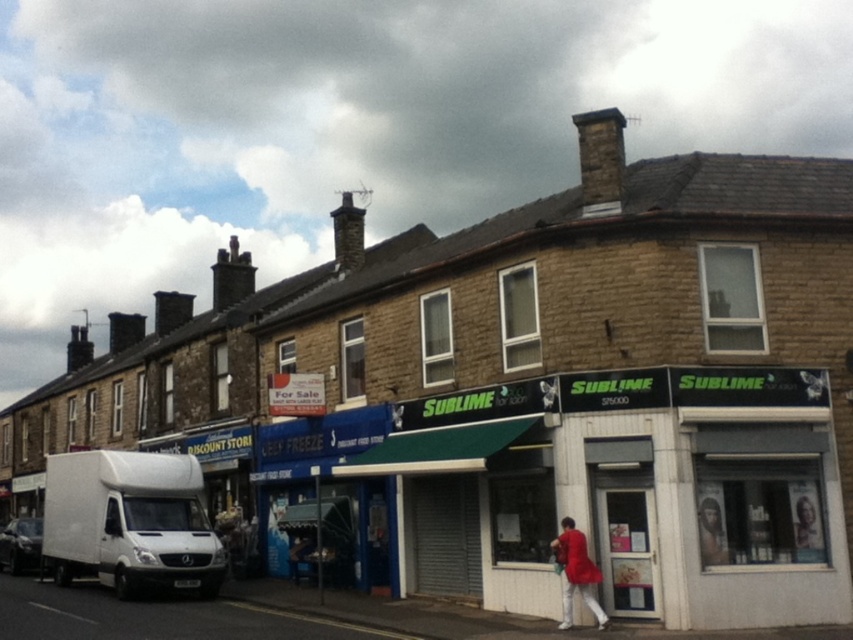
Is white matte truck at lower left bigger than white matte van at lower left?

Yes.

Which is below, white matte truck at lower left or white matte van at lower left?

white matte van at lower left is lower down.

Does point (68, 531) come closer to viewer compared to point (15, 557)?

That is True.

The image size is (853, 640). What are the coordinates of `white matte truck at lower left` in the screenshot? It's located at (129, 522).

Can you confirm if smooth brown hair at center is positioned below white matte van at lower left?

No.

Is smooth brown hair at center positioned at the back of white matte van at lower left?

No, smooth brown hair at center is closer to the viewer.

Image resolution: width=853 pixels, height=640 pixels. Find the location of `smooth brown hair at center`. smooth brown hair at center is located at coordinates 711,524.

Can you confirm if red fabric jacket at lower right is wider than white matte van at lower left?

Incorrect, red fabric jacket at lower right's width does not surpass white matte van at lower left's.

Where is `red fabric jacket at lower right`? Image resolution: width=853 pixels, height=640 pixels. red fabric jacket at lower right is located at coordinates (576, 572).